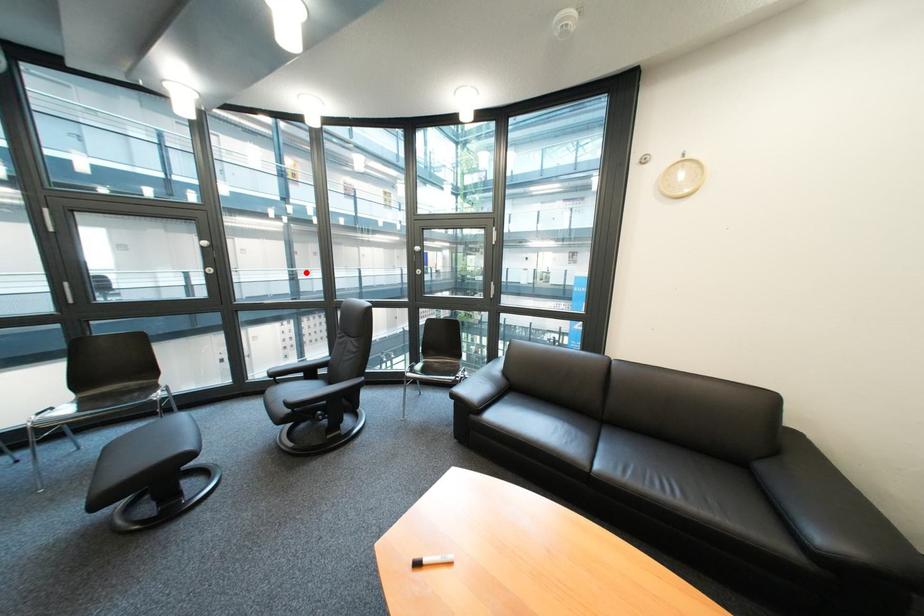
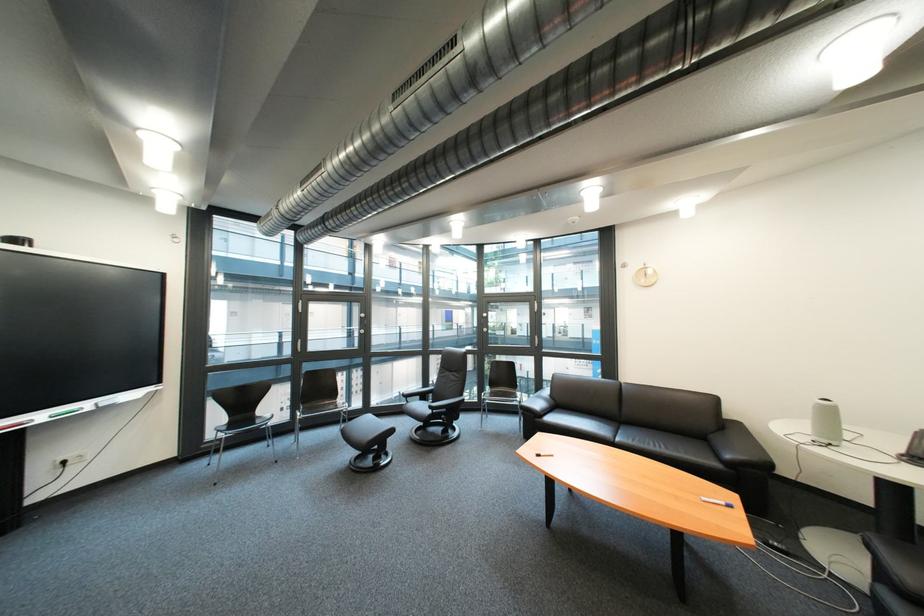
In the second image, find the point that corresponds to the highlighted location in the first image.

(363, 331)